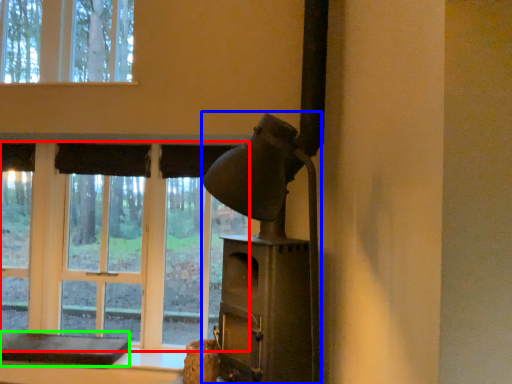
Question: Estimate the real-world distances between objects in this image. Which object is farther from bay window (highlighted by a red box), fireplace (highlighted by a blue box) or furniture (highlighted by a green box)?

Choices:
 (A) fireplace
 (B) furniture

Answer: (A)